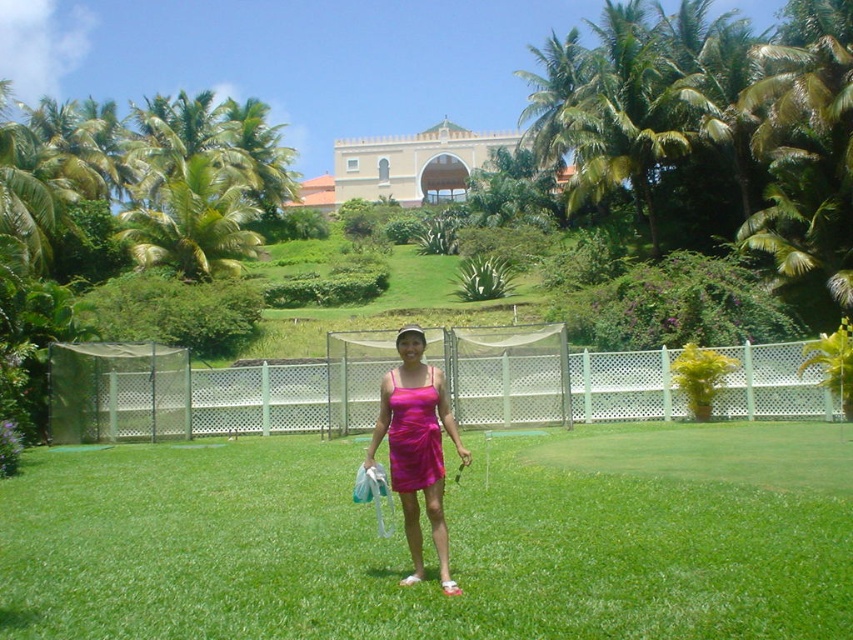
You are a fashion designer observing two dresses displayed at a runway show. The pink satin dress at center and the shiny magenta dress at center are both on display. Which dress has a bigger size?

The pink satin dress at center is larger in size than the shiny magenta dress at center.

You are a photographer trying to capture a clear image of both the pink satin dress at center and the shiny magenta dress at center. Since they are positioned close to each other, will you be able to focus on both dresses simultaneously without one blocking the other?

The pink satin dress at center is in front of the shiny magenta dress at center, so focusing on both simultaneously may be challenging as the pink satin dress at center would partially obscure the shiny magenta dress at center.